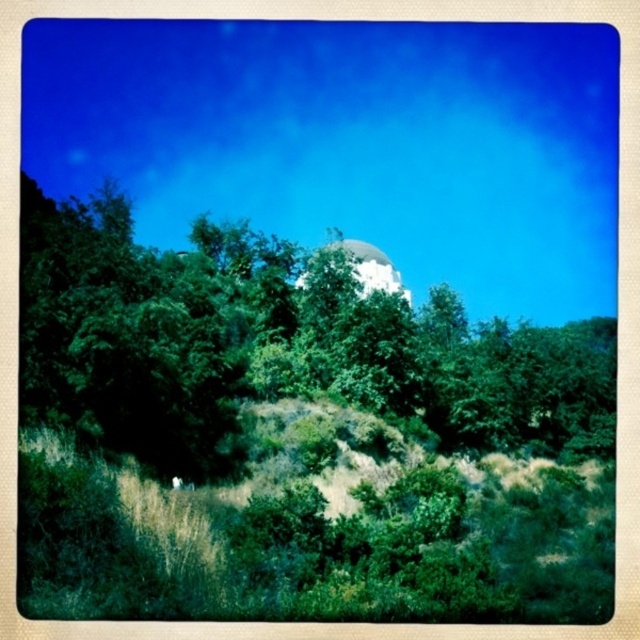
Question: Which point is farther from the camera taking this photo?

Choices:
 (A) (61, 508)
 (B) (388, 260)
 (C) (440, 296)

Answer: (B)

Question: From the image, what is the correct spatial relationship of green leafy tree at center in relation to green grassy hillside at lower center?

Choices:
 (A) below
 (B) above

Answer: (B)

Question: Does green grassy hillside at lower center appear on the left side of white glossy dome at center?

Choices:
 (A) yes
 (B) no

Answer: (B)

Question: Considering the relative positions of green grassy hillside at lower center and white glossy dome at center in the image provided, where is green grassy hillside at lower center located with respect to white glossy dome at center?

Choices:
 (A) above
 (B) below

Answer: (B)

Question: Which object is the farthest from the white glossy dome at center?

Choices:
 (A) green grassy hillside at lower center
 (B) green leafy tree at center

Answer: (A)

Question: Among these points, which one is farthest from the camera?

Choices:
 (A) (356, 266)
 (B) (595, 545)

Answer: (A)